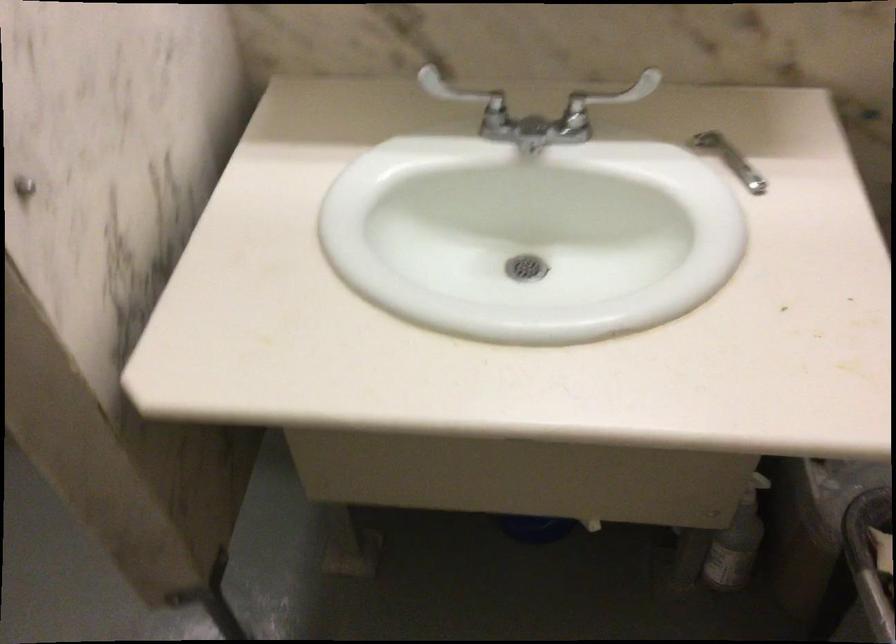
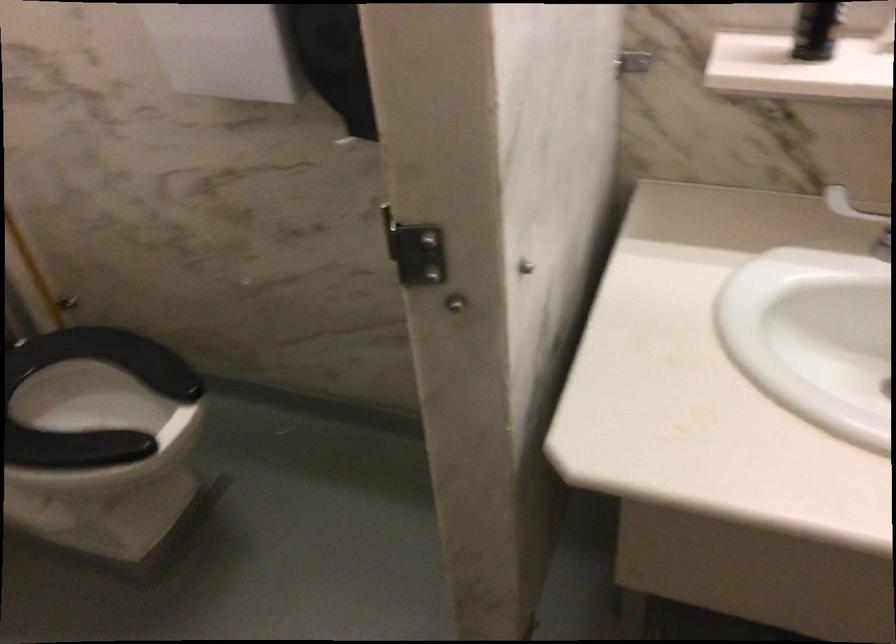
Question: Which direction would the cameraman need to move to produce the second image? Reply with the corresponding letter.

Choices:
 (A) Left
 (B) Right
 (C) Forward
 (D) Backward

Answer: (A)